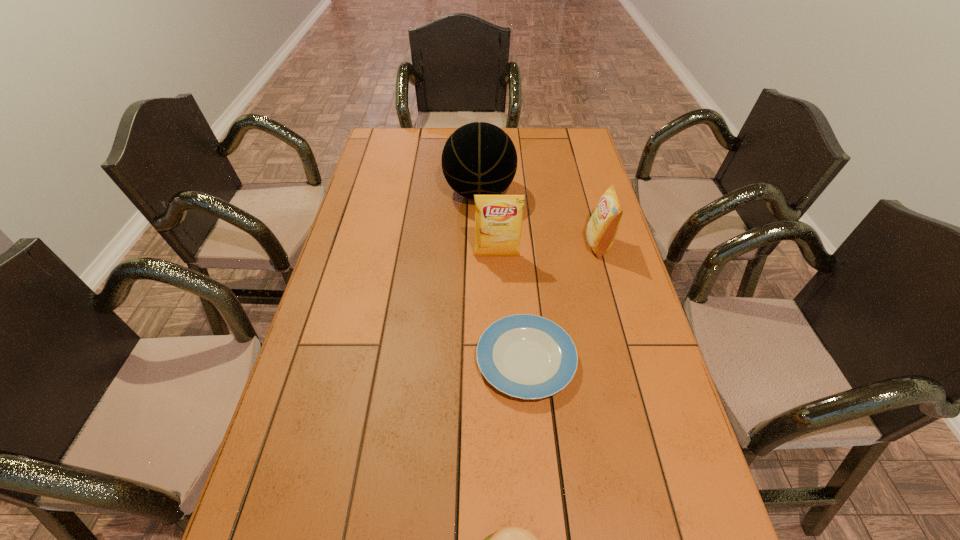
Locate an element on the screen. The height and width of the screenshot is (540, 960). basketball is located at coordinates (479, 158).

Find the location of `the left crisp (potato chip)`. the left crisp (potato chip) is located at coordinates (498, 219).

You are a GUI agent. You are given a task and a screenshot of the screen. Output one action in this format:
    pyautogui.click(x=<x>, y=<y>)
    Task: Click on the third shortest object
    The width and height of the screenshot is (960, 540).
    Given the screenshot: What is the action you would take?
    pyautogui.click(x=601, y=229)

This screenshot has height=540, width=960. What are the coordinates of `the rightmost object` in the screenshot? It's located at (601, 229).

You are a GUI agent. You are given a task and a screenshot of the screen. Output one action in this format:
    pyautogui.click(x=<x>, y=<y>)
    Task: Click on the second nearest object
    The image size is (960, 540).
    Given the screenshot: What is the action you would take?
    pyautogui.click(x=525, y=356)

Identify the location of the shortest object. (525, 356).

Where is `vacant position located 0.090m on the front of the basketball`? The height and width of the screenshot is (540, 960). vacant position located 0.090m on the front of the basketball is located at coordinates (479, 232).

In order to click on free space located on the front of the left crisp (potato chip) with the logo in this screenshot , I will do `click(498, 291)`.

Where is `vacant area situated 0.120m on the front-facing side of the third shortest object`? The image size is (960, 540). vacant area situated 0.120m on the front-facing side of the third shortest object is located at coordinates (548, 245).

The width and height of the screenshot is (960, 540). Find the location of `free region located on the front-facing side of the third shortest object`. free region located on the front-facing side of the third shortest object is located at coordinates (479, 245).